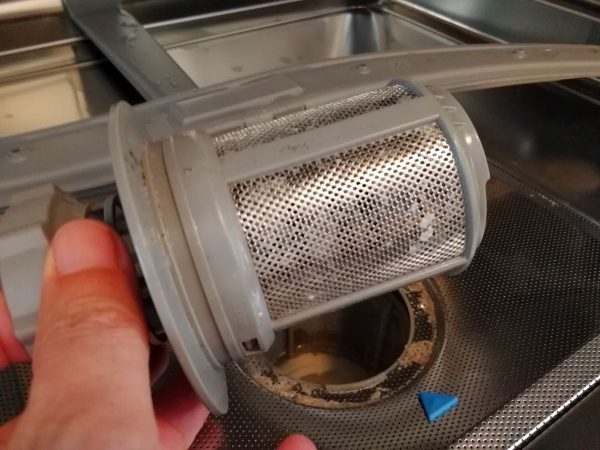
Image resolution: width=600 pixels, height=450 pixels. I want to click on support cross brace of sink, so click(x=325, y=81).